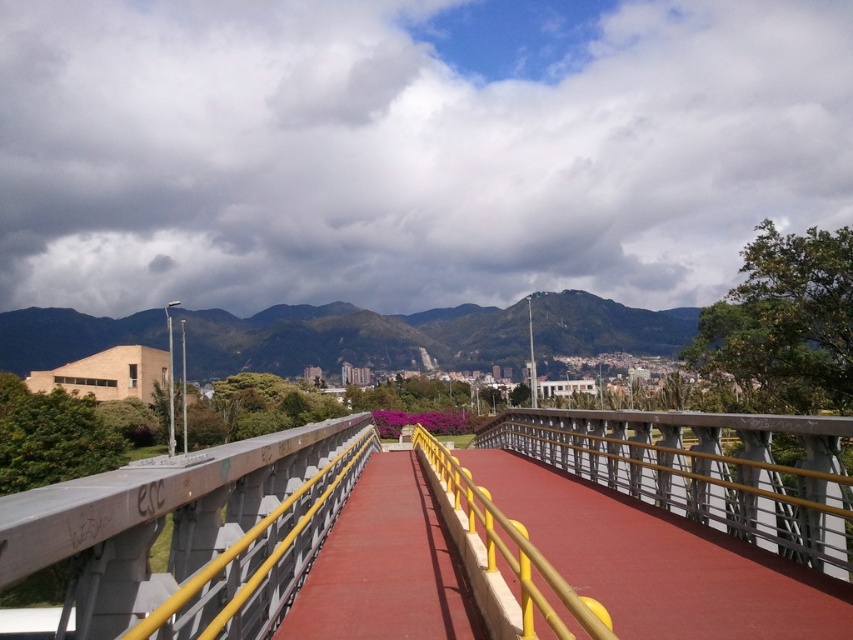
You are a construction inspector checking the elevation of the bridge and path. According to the scene, which object is positioned lower in elevation between the concrete bridge at center and the red rubber path at center?

The concrete bridge at center is located below the red rubber path at center, so the concrete bridge at center is positioned lower in elevation.

Based on the photo, you are standing at the edge of the concrete bridge at center and want to throw a small ball to a friend who is standing 2 meters away from you. Will the ball land safely on the bridge? Explain your reasoning.

The concrete bridge at center is 1.62 meters from camera. Since the ball is thrown 2 meters away, which is farther than the bridge length of 1.62 meters, the ball will likely fall off the bridge and not land safely.

You are a delivery person carrying a heavy box and need to choose between the concrete bridge at center and the red rubber path at center to reach the city. Which path is safer for carrying heavy items?

The concrete bridge at center is much taller than the red rubber path at center, so it is safer for carrying heavy items as it can support more weight.